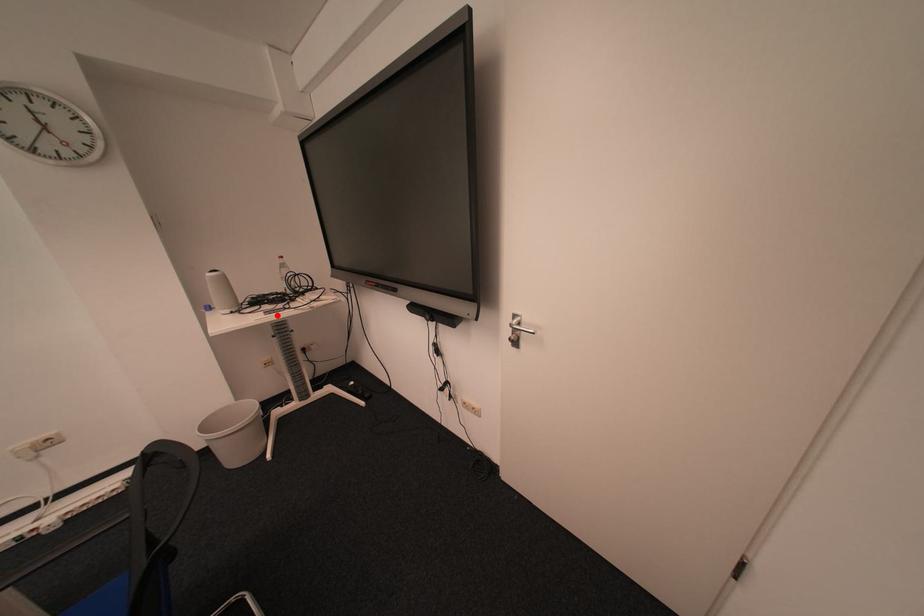
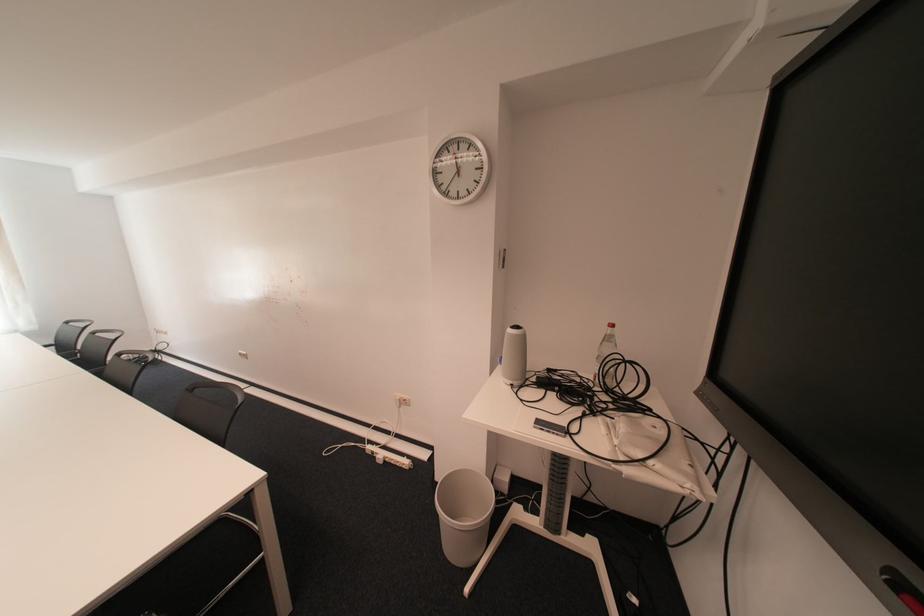
In the second image, find the point that corresponds to the highlighted location in the first image.

(545, 428)